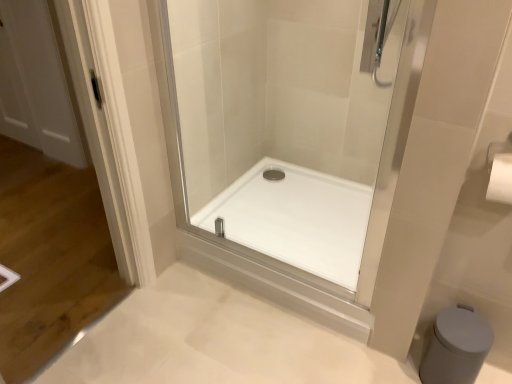
Question: Would you say white matte bidet at lower right is part of transparent glass shower door at center's contents?

Choices:
 (A) yes
 (B) no

Answer: (B)

Question: Would you say transparent glass shower door at center is a long distance from white matte bidet at lower right?

Choices:
 (A) no
 (B) yes

Answer: (A)

Question: Is transparent glass shower door at center directly adjacent to white matte bidet at lower right?

Choices:
 (A) yes
 (B) no

Answer: (B)

Question: Can you confirm if transparent glass shower door at center is positioned to the left of white matte bidet at lower right?

Choices:
 (A) yes
 (B) no

Answer: (A)

Question: Can you confirm if transparent glass shower door at center is smaller than white matte bidet at lower right?

Choices:
 (A) no
 (B) yes

Answer: (A)

Question: Is transparent glass shower door at center in front of or behind white glossy shower tray at center in the image?

Choices:
 (A) behind
 (B) front

Answer: (B)

Question: Is point (304, 160) positioned closer to the camera than point (323, 188)?

Choices:
 (A) closer
 (B) farther

Answer: (B)

Question: Is transparent glass shower door at center wider or thinner than white glossy shower tray at center?

Choices:
 (A) thin
 (B) wide

Answer: (A)

Question: Would you say transparent glass shower door at center is to the left or to the right of white glossy shower tray at center in the picture?

Choices:
 (A) right
 (B) left

Answer: (B)

Question: From a real-world perspective, is transparent glass shower door at center above or below white matte bidet at lower right?

Choices:
 (A) below
 (B) above

Answer: (B)

Question: In the image, is transparent glass shower door at center on the left side or the right side of white matte bidet at lower right?

Choices:
 (A) right
 (B) left

Answer: (B)

Question: In terms of size, does transparent glass shower door at center appear bigger or smaller than white matte bidet at lower right?

Choices:
 (A) small
 (B) big

Answer: (B)

Question: Is point (201, 193) positioned closer to the camera than point (444, 372)?

Choices:
 (A) closer
 (B) farther

Answer: (B)

Question: Is white glossy shower tray at center situated inside white matte bidet at lower right or outside?

Choices:
 (A) inside
 (B) outside

Answer: (B)

Question: In the image, is white glossy shower tray at center on the left side or the right side of white matte bidet at lower right?

Choices:
 (A) right
 (B) left

Answer: (B)